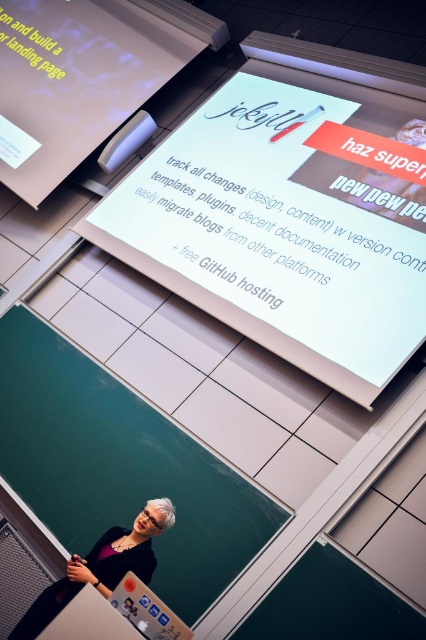
Does white glossy projection screen at upper center have a greater height compared to white paper at upper left?

No, white glossy projection screen at upper center is not taller than white paper at upper left.

Find the location of a particular element. white glossy projection screen at upper center is located at coordinates (120, 467).

The image size is (426, 640). I want to click on white glossy projection screen at upper center, so click(x=120, y=467).

Between white paper at upper left and white glossy hair at center, which one is positioned lower?

white glossy hair at center is below.

Does white paper at upper left have a lesser width compared to white glossy hair at center?

No, white paper at upper left is not thinner than white glossy hair at center.

Is point (206, 12) closer to camera compared to point (120, 534)?

No, (206, 12) is further to viewer.

Locate an element on the screen. white paper at upper left is located at coordinates (83, 76).

Is point (184, 122) closer to camera compared to point (88, 496)?

No.

Where is `white glossy projector screen at upper center`? white glossy projector screen at upper center is located at coordinates (287, 221).